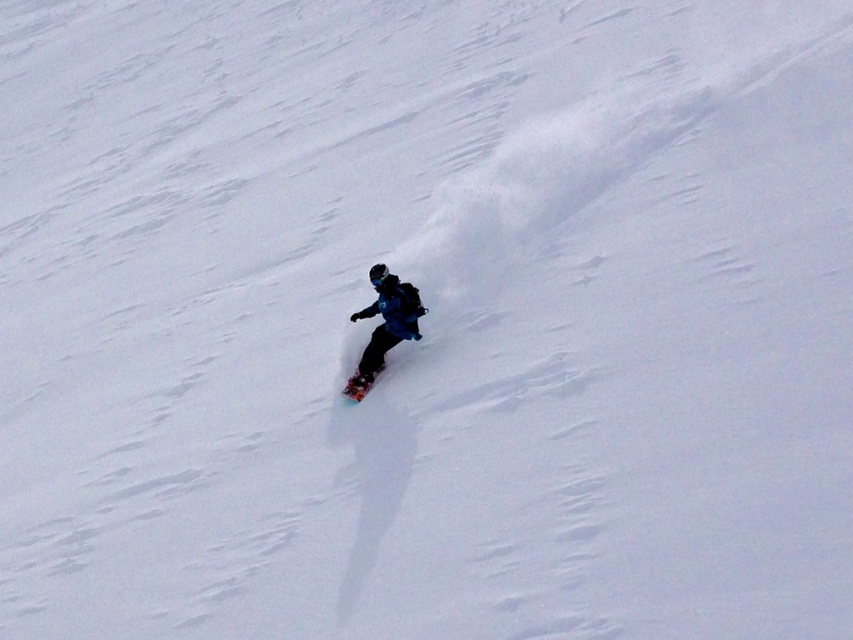
Question: Can you confirm if blue matte snowboarder at center is wider than shiny black snowboard at center?

Choices:
 (A) yes
 (B) no

Answer: (A)

Question: Is blue matte snowboarder at center to the right of shiny black snowboard at center from the viewer's perspective?

Choices:
 (A) no
 (B) yes

Answer: (B)

Question: Which object appears closest to the camera in this image?

Choices:
 (A) blue matte snowboarder at center
 (B) shiny black snowboard at center

Answer: (A)

Question: From the image, what is the correct spatial relationship of blue matte snowboarder at center in relation to shiny black snowboard at center?

Choices:
 (A) below
 (B) above

Answer: (B)

Question: Which of the following is the farthest from the observer?

Choices:
 (A) (381, 337)
 (B) (360, 390)

Answer: (A)

Question: Which object appears farthest from the camera in this image?

Choices:
 (A) shiny black snowboard at center
 (B) blue matte snowboarder at center

Answer: (A)